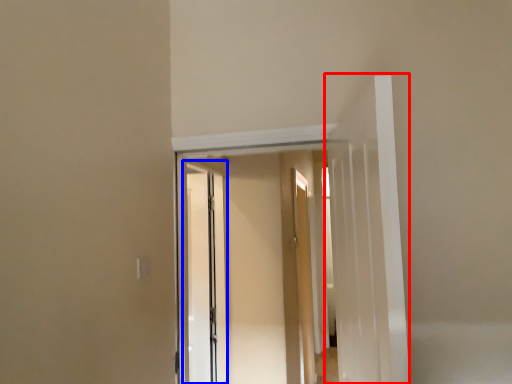
Question: Which of the following is the farthest to the observer, door (highlighted by a red box) or screen door (highlighted by a blue box)?

Choices:
 (A) door
 (B) screen door

Answer: (B)